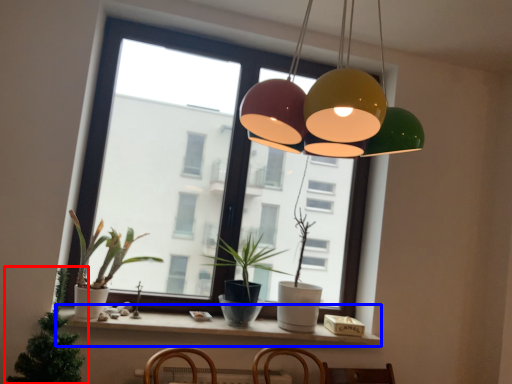
Question: Which object appears closest to the camera in this image, houseplant (highlighted by a red box) or window sill (highlighted by a blue box)?

Choices:
 (A) houseplant
 (B) window sill

Answer: (A)